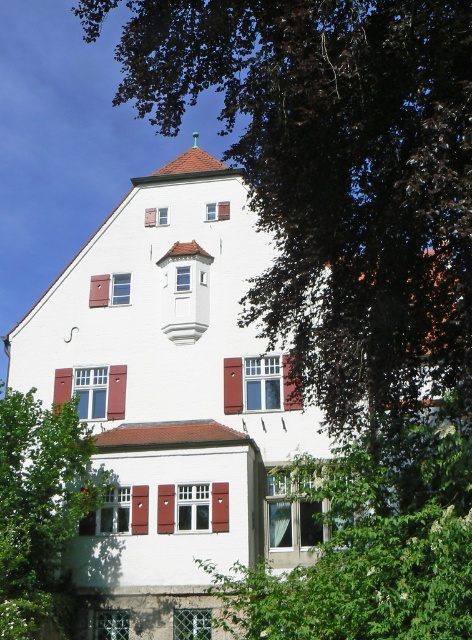
Question: Is green leafy tree at lower center closer to the viewer compared to matte wood shutter at upper left?

Choices:
 (A) yes
 (B) no

Answer: (A)

Question: Can you confirm if brown wooden shutter at center is smaller than matte wood shutter at upper left?

Choices:
 (A) yes
 (B) no

Answer: (B)

Question: Which point is closer to the camera?

Choices:
 (A) (72, 413)
 (B) (444, 598)

Answer: (B)

Question: Among these points, which one is farthest from the camera?

Choices:
 (A) (365, 595)
 (B) (119, 296)
 (C) (225, 522)
 (D) (262, 396)

Answer: (B)

Question: Which object is the farthest from the green leafy tree at lower center?

Choices:
 (A) matte wood shutter at center
 (B) red wood window at center
 (C) red wood shutter at lower center

Answer: (A)

Question: Observing the image, what is the correct spatial positioning of green leafy tree at lower center in reference to matte wood shutter at center?

Choices:
 (A) left
 (B) right

Answer: (B)